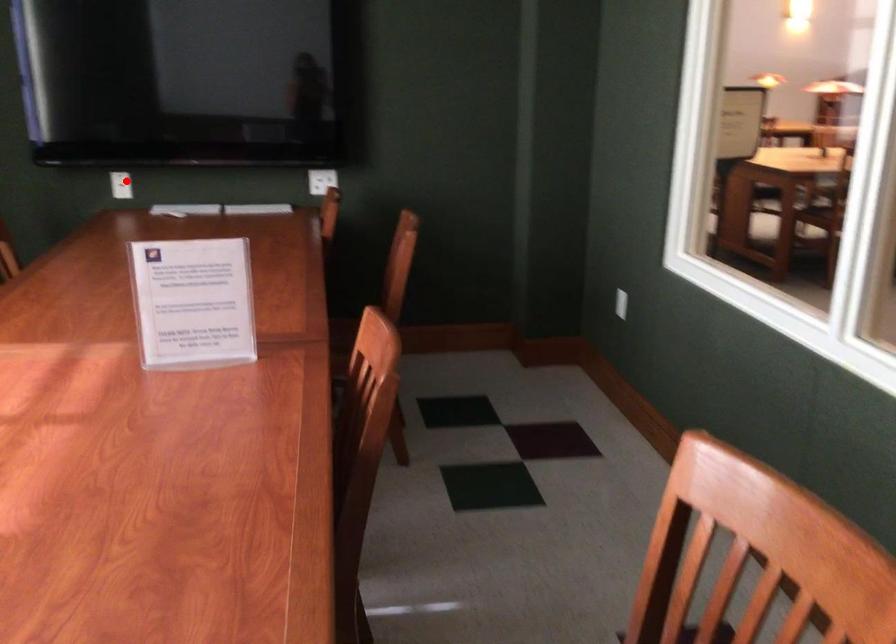
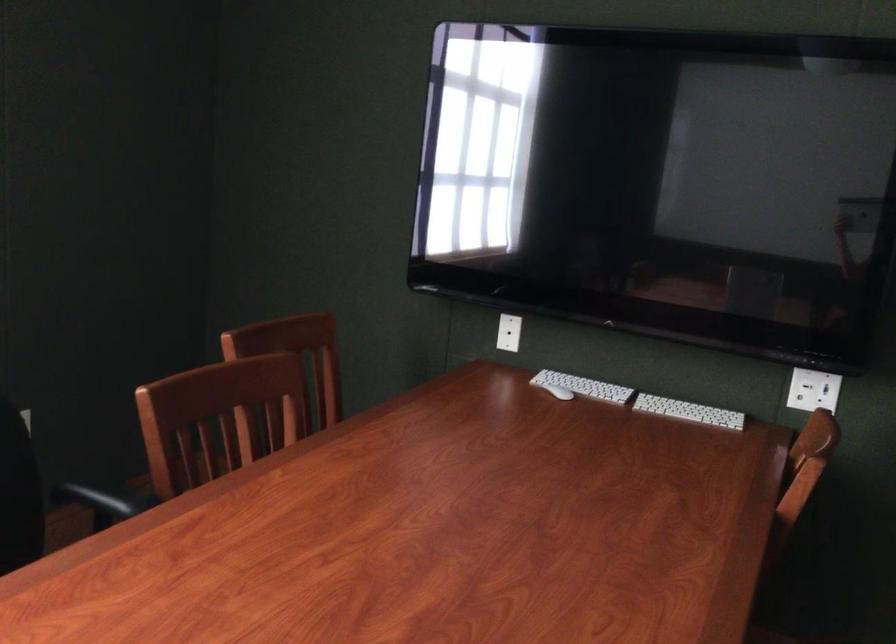
Where in the second image is the point corresponding to the highlighted location from the first image?

(509, 333)